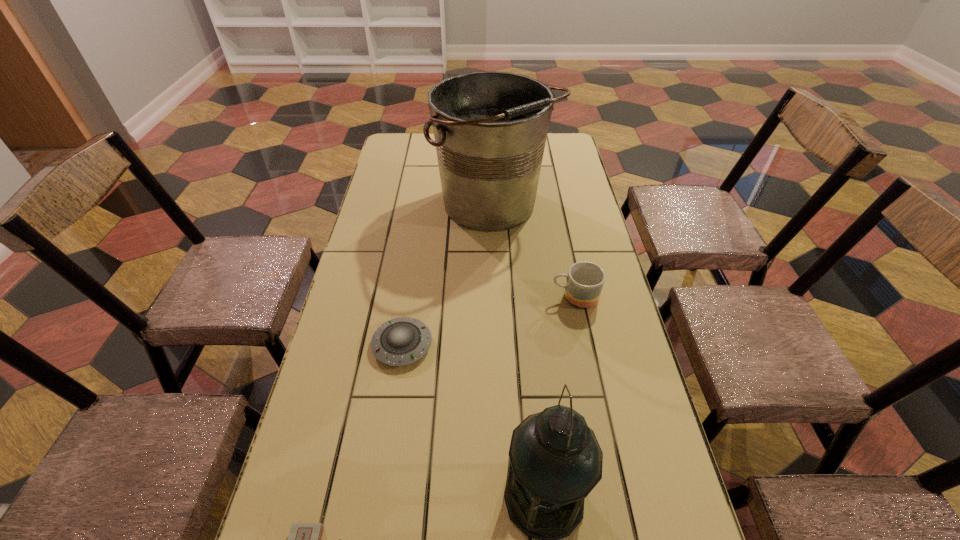
I want to click on object at the left edge, so click(x=401, y=341).

This screenshot has width=960, height=540. I want to click on bucket positioned at the right edge, so click(490, 128).

Where is `mug located in the right edge section of the desktop`? This screenshot has width=960, height=540. mug located in the right edge section of the desktop is located at coordinates (585, 280).

The width and height of the screenshot is (960, 540). In the image, there is a desktop. In order to click on vacant space at the left edge in this screenshot , I will do `click(393, 199)`.

Identify the location of vacant region at the right edge of the desktop. This screenshot has height=540, width=960. (607, 453).

Identify the location of vacant area at the far right corner. The width and height of the screenshot is (960, 540). (x=543, y=158).

This screenshot has width=960, height=540. Find the location of `free space between the farthest object and the second farthest object`. free space between the farthest object and the second farthest object is located at coordinates (534, 252).

Find the location of a particular element. vacant area that lies between the second farthest object and the fourth tallest object is located at coordinates (489, 321).

This screenshot has height=540, width=960. Identify the location of empty space between the second shortest object and the farthest object. (448, 276).

You are a GUI agent. You are given a task and a screenshot of the screen. Output one action in this format:
    pyautogui.click(x=<x>, y=<y>)
    Task: Click on the closest object to the saucer
    The width and height of the screenshot is (960, 540).
    Given the screenshot: What is the action you would take?
    pyautogui.click(x=555, y=461)